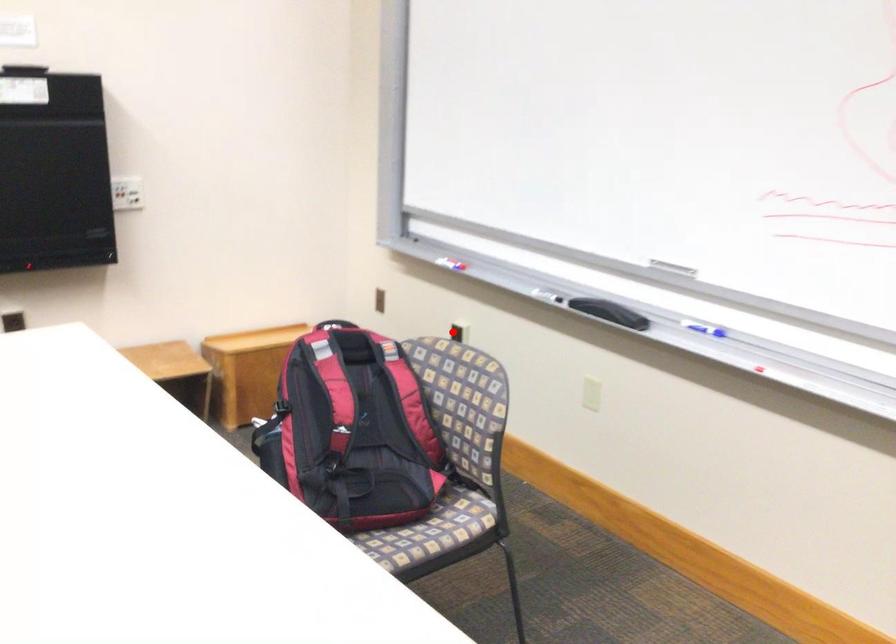
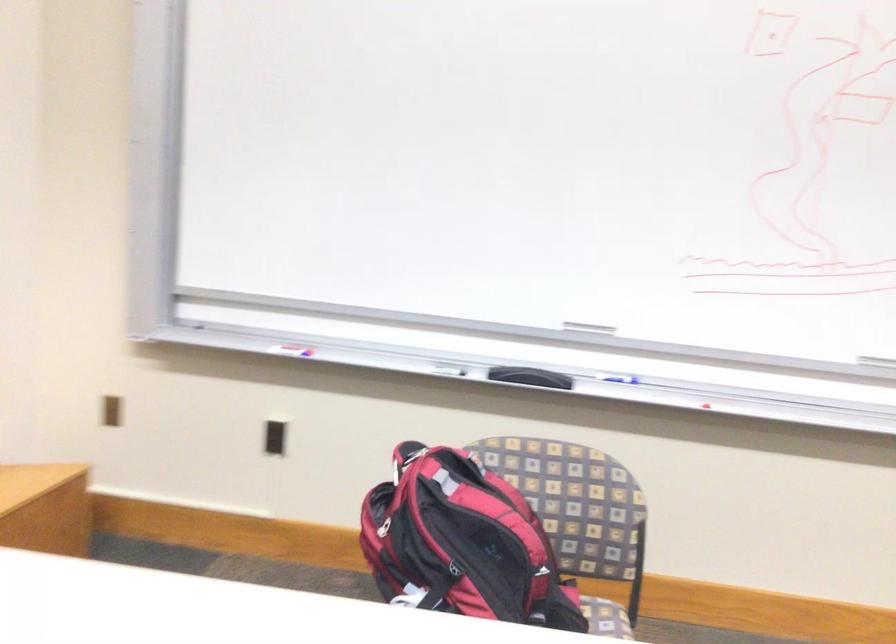
In the second image, find the point that corresponds to the highlighted location in the first image.

(273, 438)